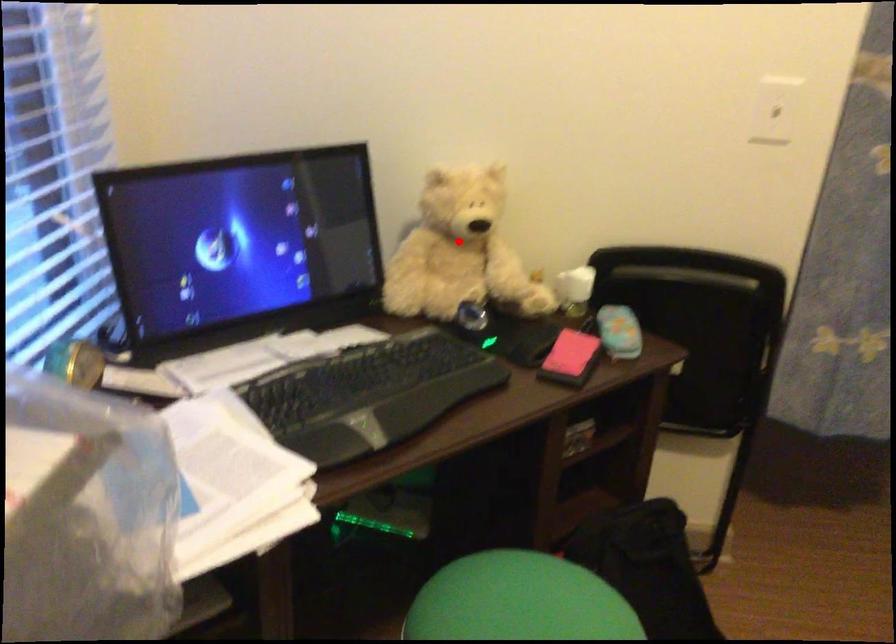
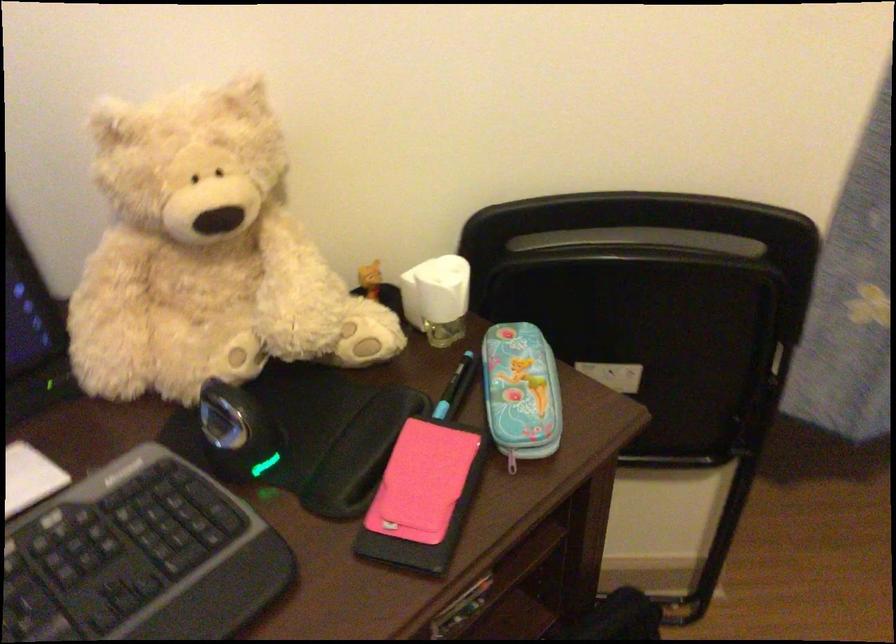
Question: A red point is marked in image1. In image2, is the corresponding 3D point closer to the camera or farther? Reply with the corresponding letter.

Choices:
 (A) The corresponding 3D point is closer.
 (B) The corresponding 3D point is farther.

Answer: (A)